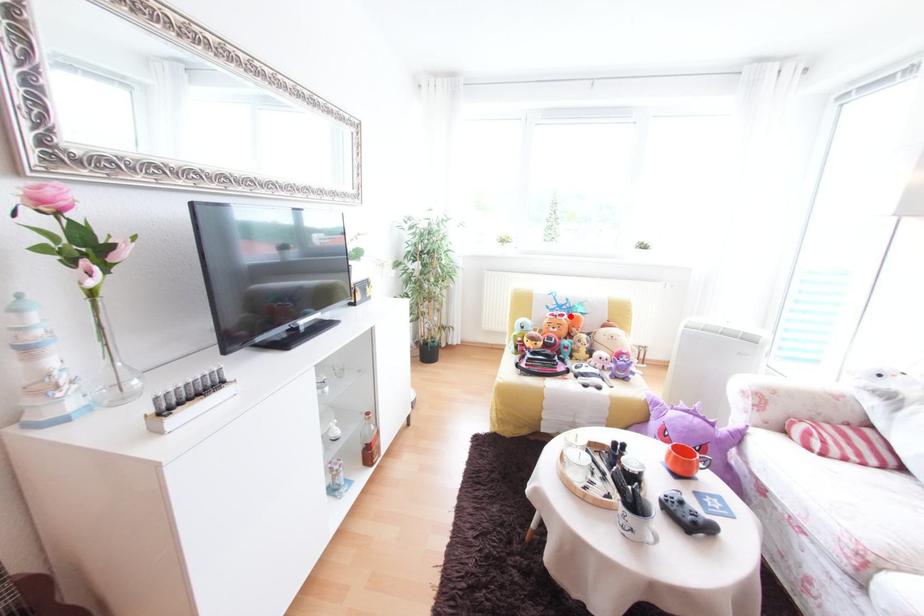
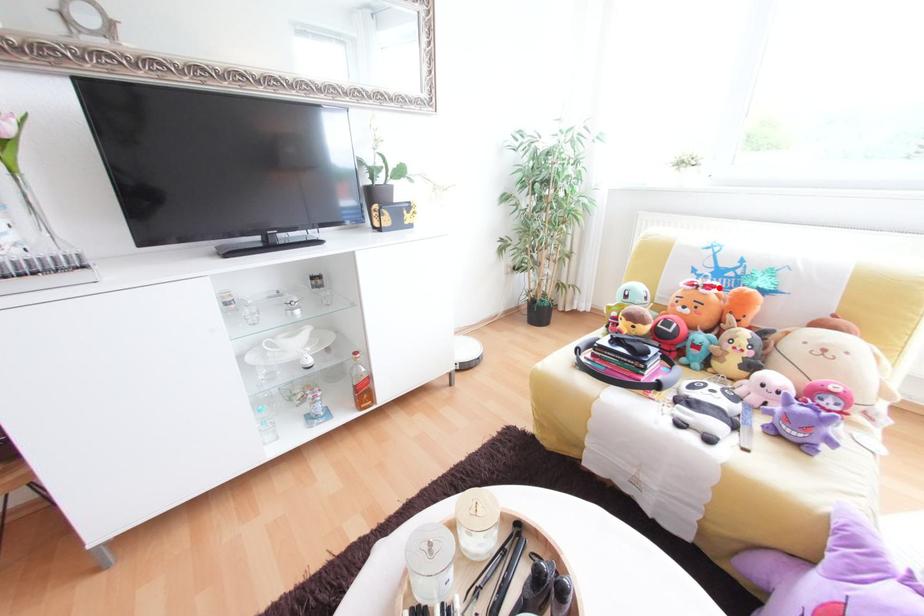
I am providing you with two images of the same scene from different viewpoints. A red point is marked on the first image and another point is marked on the second image. Is the red point in image1 aligned with the point shown in image2?

Yes